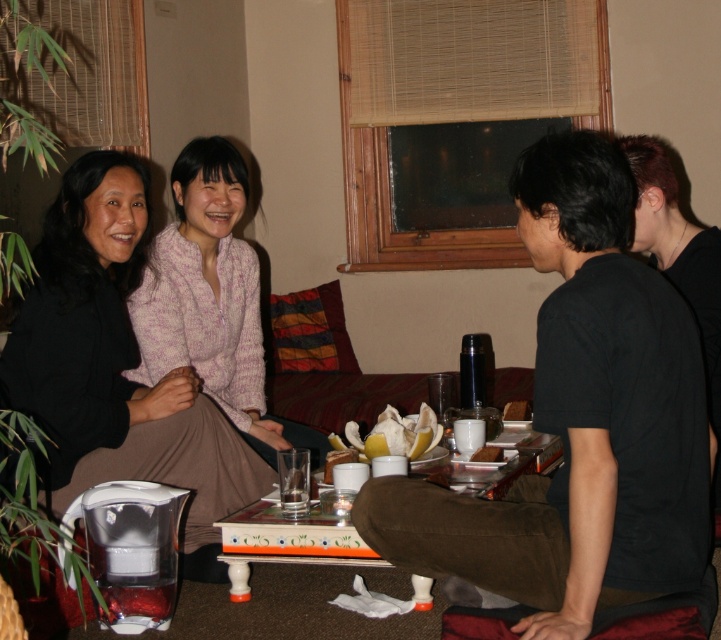
You are a photographer trying to capture a candid shot of the black matte shirt at right and the wooden painted table at center. Since you want to focus on the shirt, which object should you position closer to the camera?

The black matte shirt at right is in front of the wooden painted table at center, so to focus on the shirt, position it closer to the camera.

You are a photographer setting up a camera at the same height as the wooden painted table at center. You want to capture the black matte shirt at right in your shot. Will the shirt be visible above the table in the photo?

The black matte shirt at right is taller than the wooden painted table at center, so yes, the shirt will be visible above the table in the photo since it extends higher than the table.